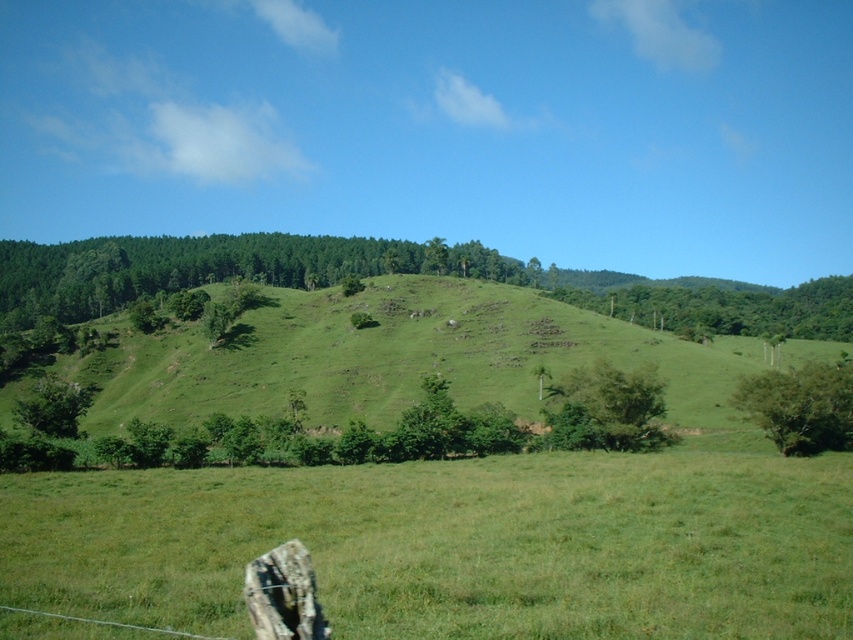
Question: Which point is farther to the camera?

Choices:
 (A) green grassy field at center
 (B) green leafy tree at lower left
 (C) green leafy tree at center-right

Answer: (B)

Question: Is green leafy tree at center bigger than green leafy tree at center-right?

Choices:
 (A) yes
 (B) no

Answer: (A)

Question: Is green leafy tree at center to the right of green leafy tree at center-right from the viewer's perspective?

Choices:
 (A) yes
 (B) no

Answer: (B)

Question: Which point is farther from the camera taking this photo?

Choices:
 (A) (589, 442)
 (B) (54, 417)
 (C) (782, 394)
 (D) (592, 547)

Answer: (B)

Question: Which point appears farthest from the camera in this image?

Choices:
 (A) (68, 387)
 (B) (566, 403)
 (C) (210, 264)
 (D) (819, 417)

Answer: (C)

Question: Is green grassy field at center smaller than green leafy tree at center?

Choices:
 (A) yes
 (B) no

Answer: (B)